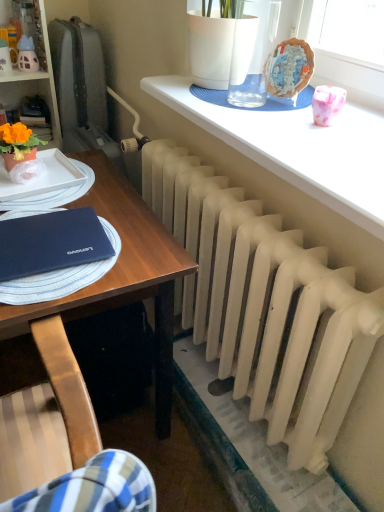
You are a GUI agent. You are given a task and a screenshot of the screen. Output one action in this format:
    pyautogui.click(x=<x>, y=<y>)
    Task: Click on the free space to the left of fluffy fabric flower at upper center
    This screenshot has height=512, width=384.
    Given the screenshot: What is the action you would take?
    pyautogui.click(x=242, y=91)